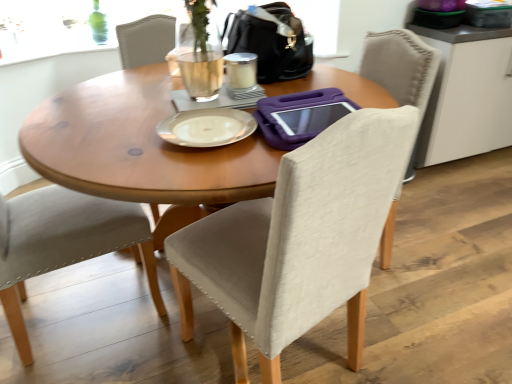
Question: Is white matte cabinet at upper right looking in the opposite direction of beige fabric chair at center, the 1th chair when ordered from right to left?

Choices:
 (A) yes
 (B) no

Answer: (B)

Question: Is white matte cabinet at upper right outside beige fabric chair at center, which is counted as the 2th chair, starting from the left?

Choices:
 (A) yes
 (B) no

Answer: (A)

Question: Is white matte cabinet at upper right thinner than beige fabric chair at center, which is counted as the 2th chair, starting from the left?

Choices:
 (A) yes
 (B) no

Answer: (A)

Question: Considering the relative sizes of white matte cabinet at upper right and beige fabric chair at center, which is counted as the 2th chair, starting from the left, in the image provided, is white matte cabinet at upper right wider than beige fabric chair at center, which is counted as the 2th chair, starting from the left,?

Choices:
 (A) no
 (B) yes

Answer: (A)

Question: Considering the relative positions of white matte cabinet at upper right and beige fabric chair at center, the 1th chair when ordered from right to left, in the image provided, is white matte cabinet at upper right in front of beige fabric chair at center, the 1th chair when ordered from right to left,?

Choices:
 (A) yes
 (B) no

Answer: (B)

Question: From their relative heights in the image, would you say black leather handbag at upper center is taller or shorter than silver metallic plate at center?

Choices:
 (A) short
 (B) tall

Answer: (B)

Question: From the image's perspective, is black leather handbag at upper center positioned above or below silver metallic plate at center?

Choices:
 (A) above
 (B) below

Answer: (A)

Question: In the image, is black leather handbag at upper center on the left side or the right side of silver metallic plate at center?

Choices:
 (A) left
 (B) right

Answer: (B)

Question: Is black leather handbag at upper center in front of or behind silver metallic plate at center in the image?

Choices:
 (A) behind
 (B) front

Answer: (A)

Question: Which is correct: matte glass coffee cup at center is inside light beige fabric chair at left, which appears as the 2th chair when viewed from the right, or outside of it?

Choices:
 (A) outside
 (B) inside

Answer: (A)

Question: Considering the relative positions of matte glass coffee cup at center and light beige fabric chair at left, which appears as the 2th chair when viewed from the right, in the image provided, is matte glass coffee cup at center to the left or to the right of light beige fabric chair at left, which appears as the 2th chair when viewed from the right,?

Choices:
 (A) right
 (B) left

Answer: (A)

Question: In the image, is matte glass coffee cup at center positioned in front of or behind light beige fabric chair at left, which appears as the 2th chair when viewed from the right?

Choices:
 (A) front
 (B) behind

Answer: (B)

Question: From a real-world perspective, is matte glass coffee cup at center above or below light beige fabric chair at left, which appears as the 2th chair when viewed from the right?

Choices:
 (A) below
 (B) above

Answer: (B)

Question: Is light beige fabric chair at left, which is the first chair in left-to-right order, inside the boundaries of wooden table at center, or outside?

Choices:
 (A) inside
 (B) outside

Answer: (B)

Question: In terms of height, does light beige fabric chair at left, which is the first chair in left-to-right order, look taller or shorter compared to wooden table at center?

Choices:
 (A) short
 (B) tall

Answer: (B)